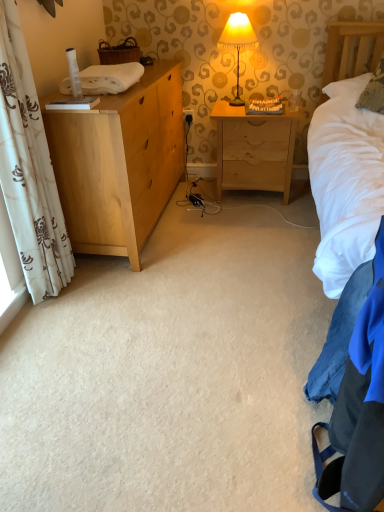
From the picture: What is the approximate height of textured beige pillow at upper right?

textured beige pillow at upper right is 17.34 inches in height.

The height and width of the screenshot is (512, 384). I want to click on white soft towel at left, so click(110, 78).

Locate an element on the screen. The image size is (384, 512). yellow fabric lampshade at upper center is located at coordinates (238, 42).

Is point (380, 70) closer or farther from the camera than point (255, 166)?

Point (380, 70) appears to be closer to the viewer than point (255, 166).

From the image's perspective, does textured beige pillow at upper right appear lower than light wood nightstand at center?

Actually, textured beige pillow at upper right appears above light wood nightstand at center in the image.

The height and width of the screenshot is (512, 384). Identify the location of nightstand below the textured beige pillow at upper right (from the image's perspective). (254, 149).

Could you tell me if textured beige pillow at upper right is facing light wood nightstand at center?

No, textured beige pillow at upper right is not facing towards light wood nightstand at center.

From the image's perspective, is white floral fabric curtain at left located beneath light wood nightstand at center?

Yes, from the image's perspective, white floral fabric curtain at left is below light wood nightstand at center.

Is white floral fabric curtain at left oriented towards light wood nightstand at center?

No, white floral fabric curtain at left does not turn towards light wood nightstand at center.

The height and width of the screenshot is (512, 384). I want to click on nightstand above the white floral fabric curtain at left (from the image's perspective), so click(254, 149).

Is white floral fabric curtain at left not close to light wood nightstand at center?

Yes.

Based on the photo, could you tell me if white floral fabric curtain at left is turned towards yellow fabric lampshade at upper center?

No, white floral fabric curtain at left is not aimed at yellow fabric lampshade at upper center.

Which object is closer to the camera taking this photo, white floral fabric curtain at left or yellow fabric lampshade at upper center?

white floral fabric curtain at left is in front.

Between white floral fabric curtain at left and yellow fabric lampshade at upper center, which one has larger size?

white floral fabric curtain at left is bigger.

Which object is thinner, white floral fabric curtain at left or yellow fabric lampshade at upper center?

white floral fabric curtain at left.

Based on their positions, is white floral fabric curtain at left located to the left or right of white soft towel at left?

In the image, white floral fabric curtain at left appears on the left side of white soft towel at left.

Who is smaller, white floral fabric curtain at left or white soft towel at left?

white soft towel at left.

What's the angular difference between white floral fabric curtain at left and white soft towel at left's facing directions?

There is a 1.74-degree angle between the facing directions of white floral fabric curtain at left and white soft towel at left.

From the image's perspective, is white floral fabric curtain at left below white soft towel at left?

Yes, from the image's perspective, white floral fabric curtain at left is beneath white soft towel at left.

Is textured beige pillow at upper right positioned with its back to white soft towel at left?

textured beige pillow at upper right does not have its back to white soft towel at left.

From a real-world perspective, is textured beige pillow at upper right located higher than white soft towel at left?

Actually, textured beige pillow at upper right is physically below white soft towel at left in the real world.

In terms of width, does textured beige pillow at upper right look wider or thinner when compared to white soft towel at left?

Considering their sizes, textured beige pillow at upper right looks broader than white soft towel at left.

Based on the photo, is white soft towel at left a part of textured beige pillow at upper right?

No, white soft towel at left is located outside of textured beige pillow at upper right.

From a real-world perspective, is yellow fabric lampshade at upper center under light wood nightstand at center?

No, from a real-world perspective, yellow fabric lampshade at upper center is not below light wood nightstand at center.

I want to click on bedside lamp on the left of the light wood nightstand at center, so click(238, 42).

Who is shorter, yellow fabric lampshade at upper center or light wood nightstand at center?

With less height is yellow fabric lampshade at upper center.

Can you confirm if yellow fabric lampshade at upper center is positioned to the left of light wood nightstand at center?

Correct, you'll find yellow fabric lampshade at upper center to the left of light wood nightstand at center.

Based on the photo, from the image's perspective, is light wood nightstand at center above or below white soft towel at left?

Based on their image positions, light wood nightstand at center is located beneath white soft towel at left.

Is light wood nightstand at center oriented towards white soft towel at left?

No, light wood nightstand at center does not turn towards white soft towel at left.

Is point (244, 122) positioned in front of point (106, 65)?

No, it is behind (106, 65).

This screenshot has height=512, width=384. Find the location of `pillow above the light wood nightstand at center (from the image's perspective)`. pillow above the light wood nightstand at center (from the image's perspective) is located at coordinates (374, 91).

Where is `curtain on the left of light wood nightstand at center`? The height and width of the screenshot is (512, 384). curtain on the left of light wood nightstand at center is located at coordinates (29, 169).

Considering their positions, is light wood chest of drawers at left positioned closer to white soft towel at left than light wood nightstand at center?

The object closer to white soft towel at left is light wood chest of drawers at left.

Looking at the image, which one is located closer to textured beige pillow at upper right, light wood nightstand at center or white floral fabric curtain at left?

light wood nightstand at center lies closer to textured beige pillow at upper right than the other object.

From the picture: Looking at the image, which one is located further to white floral fabric curtain at left, yellow fabric lampshade at upper center or light wood nightstand at center?

Among the two, yellow fabric lampshade at upper center is located further to white floral fabric curtain at left.

Considering their positions, is textured beige pillow at upper right positioned further to white floral fabric curtain at left than light wood nightstand at center?

textured beige pillow at upper right is positioned further to the anchor white floral fabric curtain at left.

Which object lies nearer to the anchor point white floral fabric curtain at left, light wood nightstand at center or white soft towel at left?

white soft towel at left is closer to white floral fabric curtain at left.

Estimate the real-world distances between objects in this image. Which object is closer to light wood chest of drawers at left, textured beige pillow at upper right or white soft towel at left?

Based on the image, white soft towel at left appears to be nearer to light wood chest of drawers at left.

Estimate the real-world distances between objects in this image. Which object is further from white floral fabric curtain at left, white soft towel at left or textured beige pillow at upper right?

Among the two, textured beige pillow at upper right is located further to white floral fabric curtain at left.

Looking at the image, which one is located further to yellow fabric lampshade at upper center, textured beige pillow at upper right or light wood nightstand at center?

The object further to yellow fabric lampshade at upper center is textured beige pillow at upper right.

This screenshot has height=512, width=384. In order to click on chest of drawers between white floral fabric curtain at left and yellow fabric lampshade at upper center in the front-back direction in this screenshot , I will do click(x=119, y=163).

Identify the location of nightstand between light wood chest of drawers at left and textured beige pillow at upper right in the horizontal direction. Image resolution: width=384 pixels, height=512 pixels. (254, 149).

At what (x,y) coordinates should I click in order to perform the action: click on bedside lamp between white soft towel at left and light wood nightstand at center in the horizontal direction. Please return your answer as a coordinate pair (x, y). This screenshot has width=384, height=512. Looking at the image, I should click on (238, 42).

Locate an element on the screen. cloth between white floral fabric curtain at left and yellow fabric lampshade at upper center from front to back is located at coordinates (110, 78).